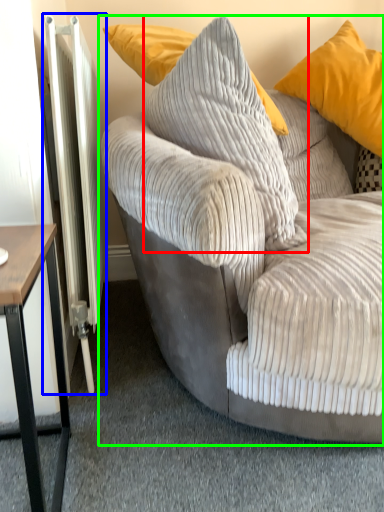
Question: Which is farther away from pillow (highlighted by a red box)? radiator (highlighted by a blue box) or studio couch (highlighted by a green box)?

Choices:
 (A) radiator
 (B) studio couch

Answer: (A)